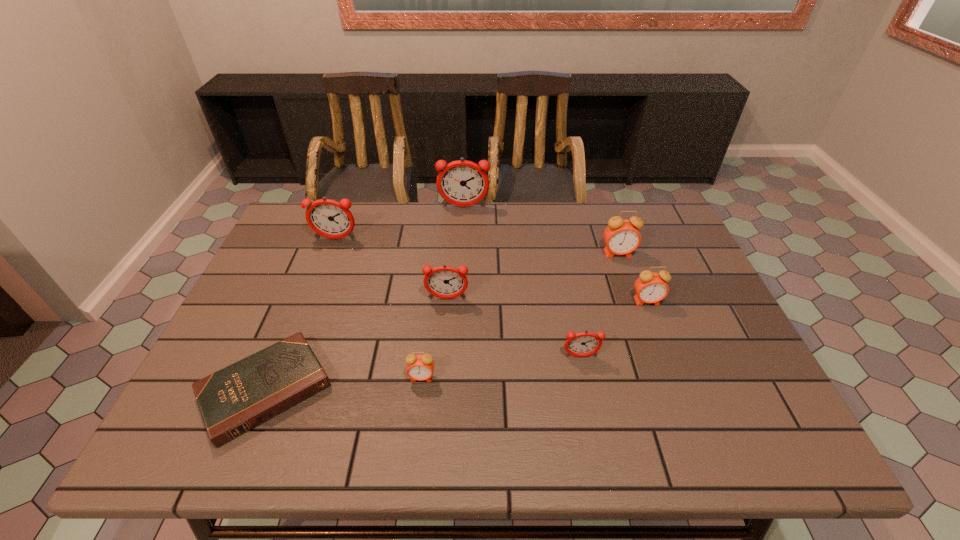
The height and width of the screenshot is (540, 960). I want to click on vacant space at the right edge of the desktop, so click(709, 394).

In the image, there is a desktop. Identify the location of vacant space at the far right corner. Image resolution: width=960 pixels, height=540 pixels. (636, 208).

Find the location of `vacant region between the Bible and the second biggest reddish-pink alarm clock`. vacant region between the Bible and the second biggest reddish-pink alarm clock is located at coordinates (300, 314).

Find the location of a particular element. The height and width of the screenshot is (540, 960). unoccupied area between the nearest alarm clock and the sixth nearest alarm clock is located at coordinates (378, 308).

Find the location of a particular element. empty space that is in between the leftmost pink alarm clock and the green Bible is located at coordinates (344, 383).

The width and height of the screenshot is (960, 540). What are the coordinates of `unoccupied area between the sixth nearest alarm clock and the green Bible` in the screenshot? It's located at 300,314.

This screenshot has width=960, height=540. I want to click on free space that is in between the smallest pink alarm clock and the second biggest reddish-pink alarm clock, so click(378, 308).

Where is `vacant area between the farthest alarm clock and the biggest pink alarm clock`? Image resolution: width=960 pixels, height=540 pixels. vacant area between the farthest alarm clock and the biggest pink alarm clock is located at coordinates (540, 230).

This screenshot has width=960, height=540. In order to click on blank region between the smallest pink alarm clock and the biggest pink alarm clock in this screenshot , I will do `click(519, 315)`.

At what (x,y) coordinates should I click in order to perform the action: click on blank region between the third nearest reddish-pink alarm clock and the third biggest reddish-pink alarm clock. Please return your answer as a coordinate pair (x, y). The height and width of the screenshot is (540, 960). Looking at the image, I should click on (392, 269).